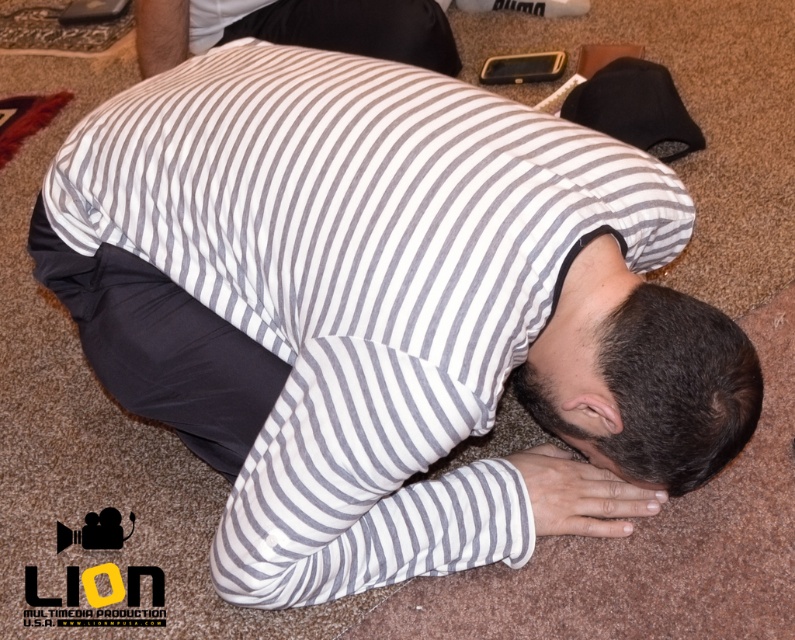
You are a photographer trying to capture a candid shot of the person in the image. You want to focus on the dark brown hair at center without the gray striped shirt at center blocking the view. Is this possible given their positions?

The gray striped shirt at center is in front of the dark brown hair at center, so it would block the view. To capture the dark brown hair at center without obstruction, you would need to adjust the angle or position to move the gray striped shirt at center out of the frame.

You are standing in the room and want to pick up an item located at point [595,442]. Can you reach it without moving your feet?

The point [595,442] is 1.20 meters away from the camera, so you can reach it without moving your feet if your arm length is at least 1.20 meters. However, typical human arm length is shorter than that, so you might need to move your feet to reach it.

You are a photographer taking a photo of the person lying on the carpeted floor. You need to ensure that both the gray striped shirt at center and the dark brown hair at center are clearly visible in the frame. Based on their sizes, which object should you focus on first to ensure proper focus?

The gray striped shirt at center is bigger than the dark brown hair at center, so focusing on the gray striped shirt at center first will ensure proper focus since larger objects require more precise focusing to capture details clearly.